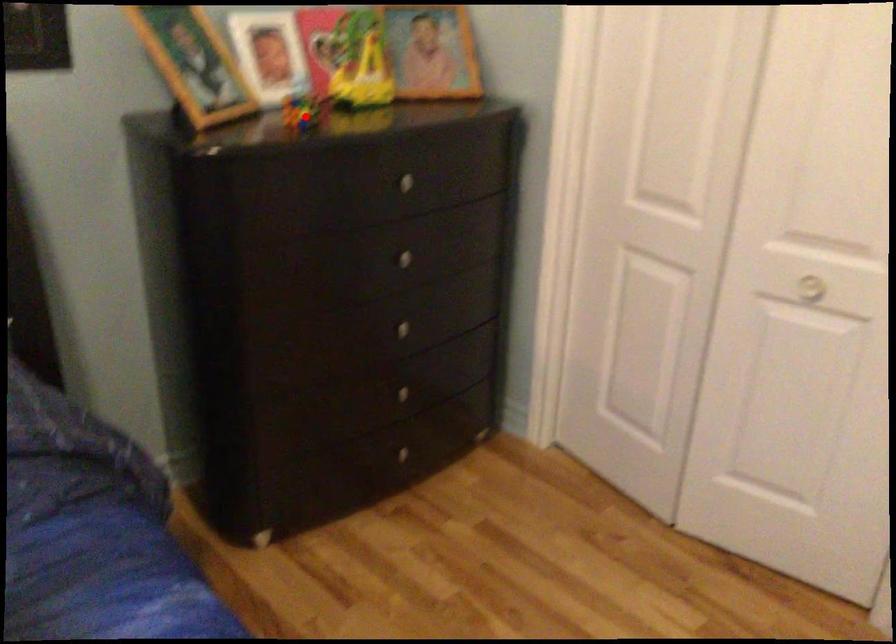
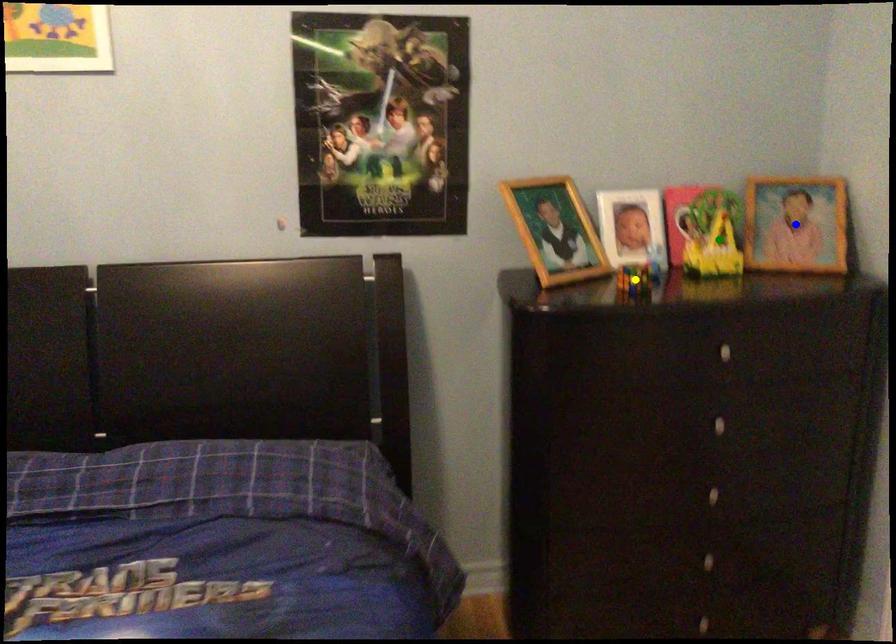
Question: I am providing you with two images of the same scene from different viewpoints. A red point is marked on the first image. You are given multiple points on the second image. Which mark in image 2 goes with the point in image 1?

Choices:
 (A) green point
 (B) yellow point
 (C) blue point

Answer: (B)